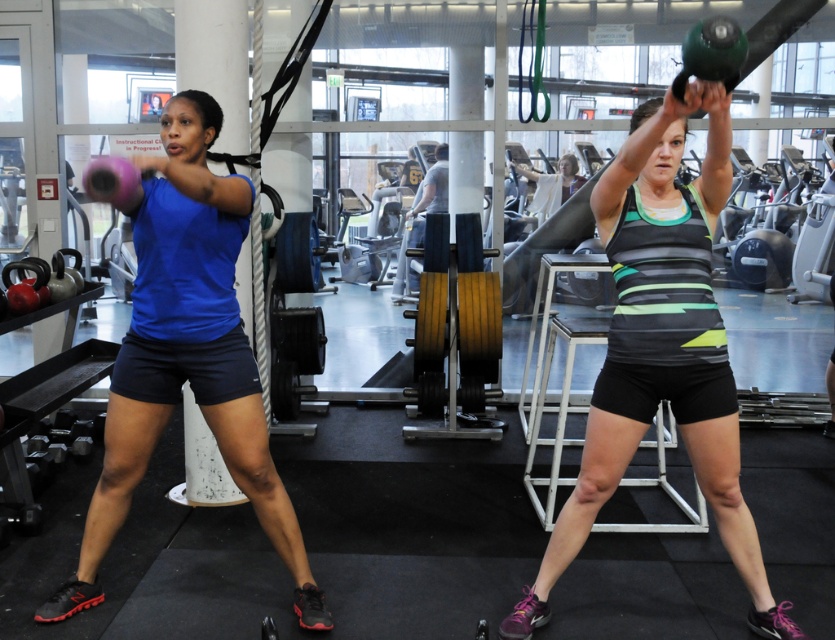
Question: Can you confirm if matte black kettlebell at center is bigger than matte pink kettlebell at left?

Choices:
 (A) yes
 (B) no

Answer: (A)

Question: Which object appears closest to the camera in this image?

Choices:
 (A) matte pink kettlebell at left
 (B) matte black kettlebell at center

Answer: (A)

Question: Does matte black kettlebell at center have a lesser width compared to matte pink kettlebell at left?

Choices:
 (A) no
 (B) yes

Answer: (A)

Question: Among these points, which one is farthest from the camera?

Choices:
 (A) (195, 355)
 (B) (636, 266)

Answer: (A)

Question: Is matte black kettlebell at center positioned before matte pink kettlebell at left?

Choices:
 (A) no
 (B) yes

Answer: (A)